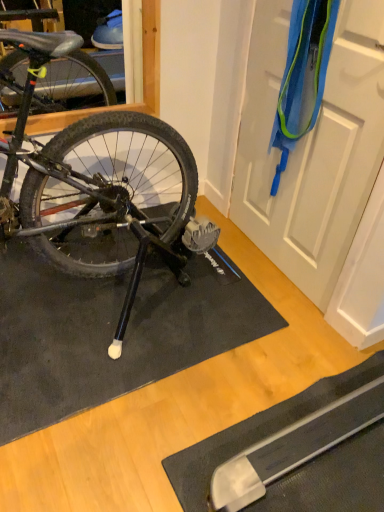
Question: Can you confirm if white matte door at upper right is bigger than black rubber doormat at lower left?

Choices:
 (A) yes
 (B) no

Answer: (B)

Question: From a real-world perspective, is white matte door at upper right over black rubber doormat at lower left?

Choices:
 (A) no
 (B) yes

Answer: (B)

Question: Is white matte door at upper right far from black rubber doormat at lower left?

Choices:
 (A) yes
 (B) no

Answer: (B)

Question: Is white matte door at upper right positioned behind black rubber doormat at lower left?

Choices:
 (A) yes
 (B) no

Answer: (B)

Question: From a real-world perspective, is white matte door at upper right positioned under black rubber doormat at lower left based on gravity?

Choices:
 (A) no
 (B) yes

Answer: (A)

Question: Is white matte door at upper right not inside black rubber doormat at lower left?

Choices:
 (A) no
 (B) yes

Answer: (B)

Question: From the image's perspective, is black rubber doormat at lower left on white matte door at upper right?

Choices:
 (A) no
 (B) yes

Answer: (A)

Question: Is black rubber doormat at lower left aimed at white matte door at upper right?

Choices:
 (A) yes
 (B) no

Answer: (B)

Question: Considering the relative positions of black rubber doormat at lower left and white matte door at upper right in the image provided, is black rubber doormat at lower left to the left of white matte door at upper right from the viewer's perspective?

Choices:
 (A) yes
 (B) no

Answer: (A)

Question: Can you confirm if black rubber doormat at lower left is smaller than white matte door at upper right?

Choices:
 (A) no
 (B) yes

Answer: (A)

Question: From a real-world perspective, is black rubber doormat at lower left beneath white matte door at upper right?

Choices:
 (A) yes
 (B) no

Answer: (A)

Question: Does black rubber doormat at lower left come in front of white matte door at upper right?

Choices:
 (A) yes
 (B) no

Answer: (B)

Question: From a real-world perspective, is black rubber doormat at lower left above or below white matte door at upper right?

Choices:
 (A) below
 (B) above

Answer: (A)